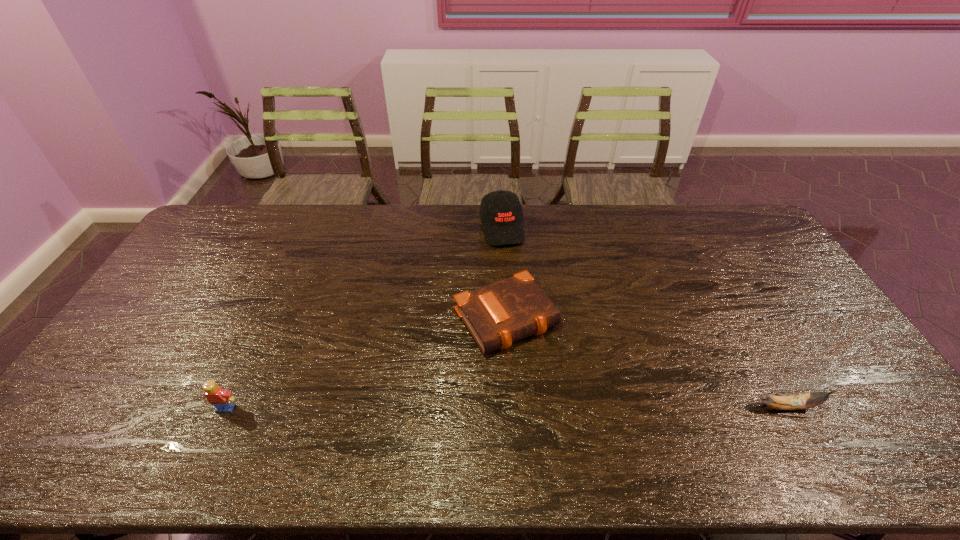
Select which object appears as the second closest to the rightmost object. Please provide its 2D coordinates. Your answer should be formatted as a tuple, i.e. [(x, y)], where the tuple contains the x and y coordinates of a point satisfying the conditions above.

[(501, 211)]

At what (x,y) coordinates should I click in order to perform the action: click on object that is the nearest to the second shortest object. Please return your answer as a coordinate pair (x, y). This screenshot has width=960, height=540. Looking at the image, I should click on (497, 315).

Where is `free space that satisfies the following two spatial constraints: 1. on the front side of the Bible; 2. at the stem of the banana`? free space that satisfies the following two spatial constraints: 1. on the front side of the Bible; 2. at the stem of the banana is located at coordinates (512, 407).

Image resolution: width=960 pixels, height=540 pixels. I want to click on vacant position in the image that satisfies the following two spatial constraints: 1. on the front side of the farthest object; 2. at the stem of the second shortest object, so click(x=512, y=407).

You are a GUI agent. You are given a task and a screenshot of the screen. Output one action in this format:
    pyautogui.click(x=<x>, y=<y>)
    Task: Click on the vacant region that satisfies the following two spatial constraints: 1. on the front side of the rightmost object; 2. at the stem of the farthest object
    This screenshot has height=540, width=960.
    Given the screenshot: What is the action you would take?
    pyautogui.click(x=512, y=407)